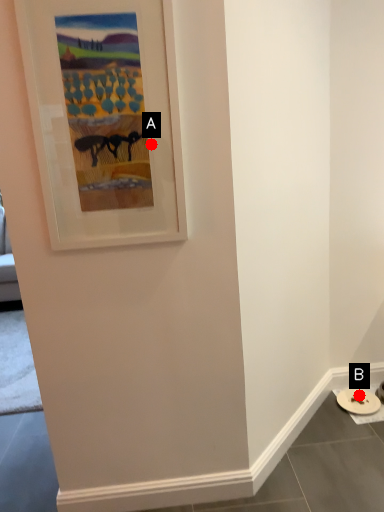
Question: Two points are circled on the image, labeled by A and B beside each circle. Which point is farther from the camera taking this photo?

Choices:
 (A) A is further
 (B) B is further

Answer: (B)